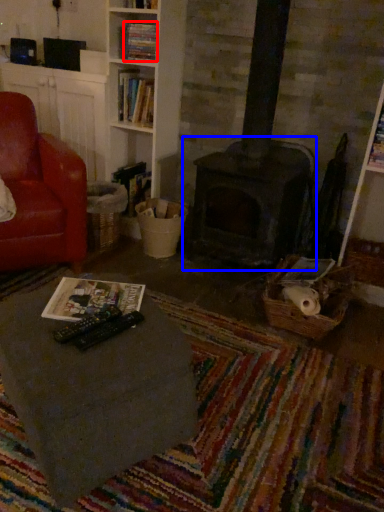
Question: Among these objects, which one is farthest to the camera, book (highlighted by a red box) or fireplace (highlighted by a blue box)?

Choices:
 (A) book
 (B) fireplace

Answer: (B)